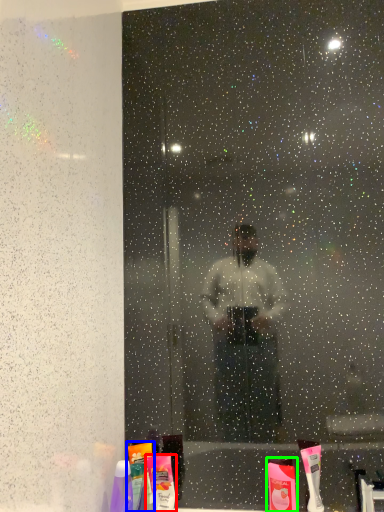
Question: Which object is the closest to the toiletry (highlighted by a red box)? Choose among these: mouthwash (highlighted by a blue box) or toiletry (highlighted by a green box).

Choices:
 (A) mouthwash
 (B) toiletry

Answer: (A)